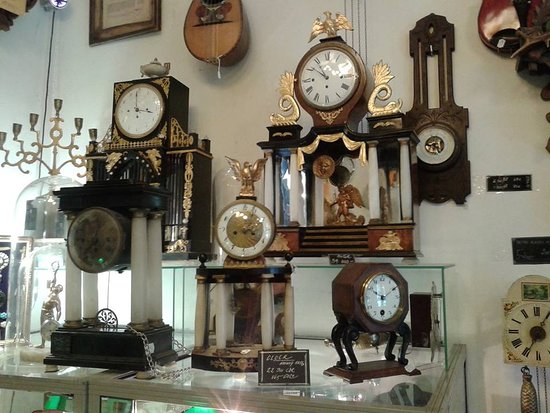
This screenshot has width=550, height=413. I want to click on clocks, so click(x=141, y=107), click(x=315, y=77), click(x=447, y=149), click(x=396, y=302), click(x=525, y=329), click(x=111, y=223), click(x=248, y=234).